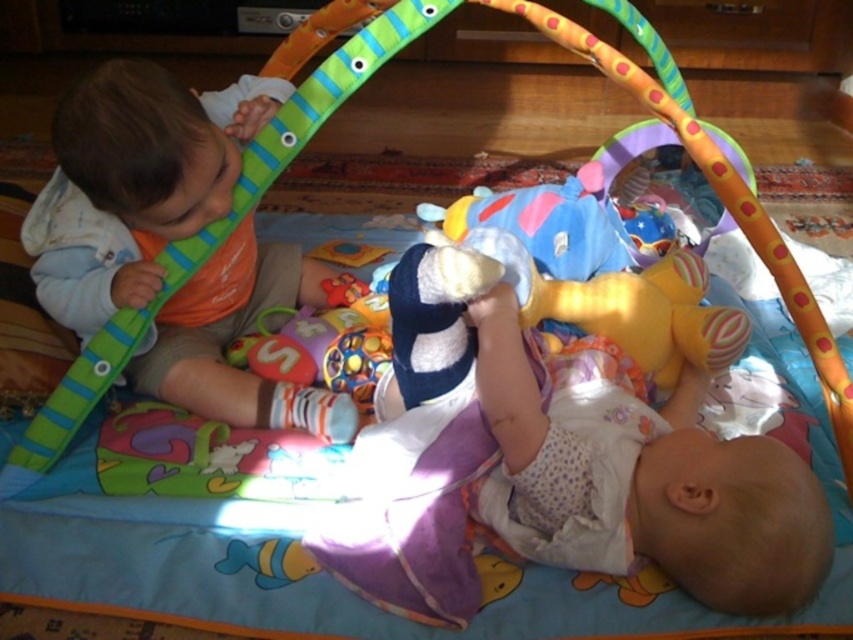
Question: Which of the following is the farthest from the observer?

Choices:
 (A) white soft baby at lower right
 (B) matte orange bib at left

Answer: (B)

Question: Which point appears closest to the camera in this image?

Choices:
 (A) (120, 273)
 (B) (664, 435)

Answer: (B)

Question: Among these points, which one is farthest from the camera?

Choices:
 (A) (68, 324)
 (B) (517, 349)

Answer: (A)

Question: Can you confirm if matte orange bib at left is positioned below white soft baby at lower right?

Choices:
 (A) yes
 (B) no

Answer: (B)

Question: Does matte orange bib at left appear over white soft baby at lower right?

Choices:
 (A) no
 (B) yes

Answer: (B)

Question: Is matte orange bib at left in front of white soft baby at lower right?

Choices:
 (A) yes
 (B) no

Answer: (B)